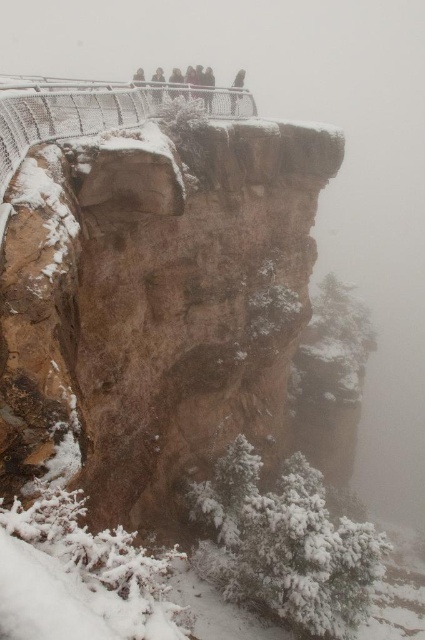
Question: Can you confirm if metal wire fence at upper center is positioned to the right of dark gray stone figure at upper center?

Choices:
 (A) yes
 (B) no

Answer: (B)

Question: Which point appears closest to the camera in this image?

Choices:
 (A) (209, 108)
 (B) (229, 96)

Answer: (A)

Question: Can you confirm if metal wire fence at upper center is thinner than dark gray stone figure at upper center?

Choices:
 (A) yes
 (B) no

Answer: (B)

Question: From the image, what is the correct spatial relationship of metal wire fence at upper center in relation to dark gray stone figure at upper center?

Choices:
 (A) left
 (B) right

Answer: (A)